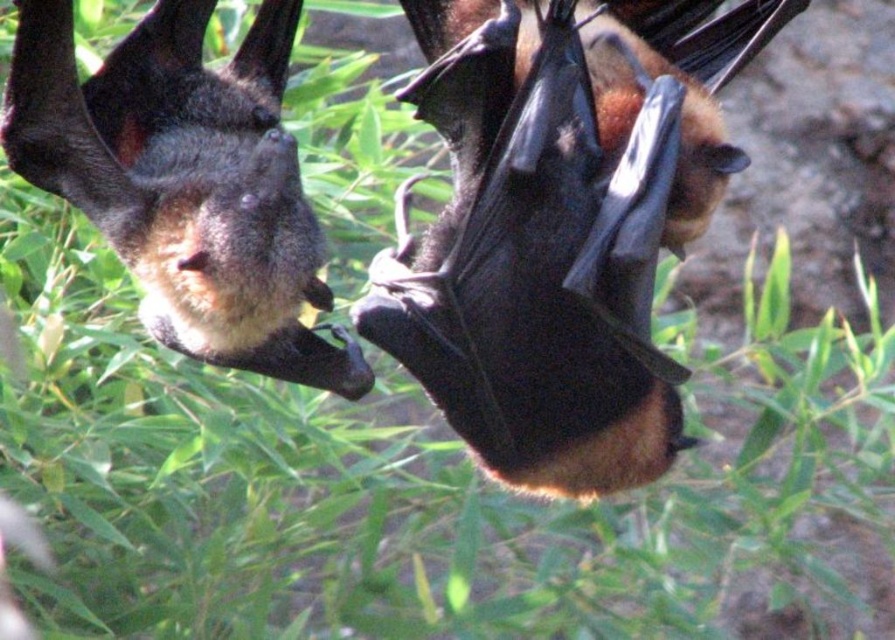
Question: Does brown furry bat at center come behind shiny brown bat at upper left?

Choices:
 (A) no
 (B) yes

Answer: (B)

Question: Can you confirm if brown furry bat at center is bigger than shiny brown bat at upper left?

Choices:
 (A) no
 (B) yes

Answer: (B)

Question: Among these objects, which one is nearest to the camera?

Choices:
 (A) brown furry bat at center
 (B) shiny brown bat at upper left

Answer: (B)

Question: Is brown furry bat at center smaller than shiny brown bat at upper left?

Choices:
 (A) no
 (B) yes

Answer: (A)

Question: Which of the following is the farthest from the observer?

Choices:
 (A) brown furry bat at center
 (B) shiny brown bat at upper left

Answer: (A)

Question: Which point is farther to the camera?

Choices:
 (A) (413, 289)
 (B) (79, 122)

Answer: (A)